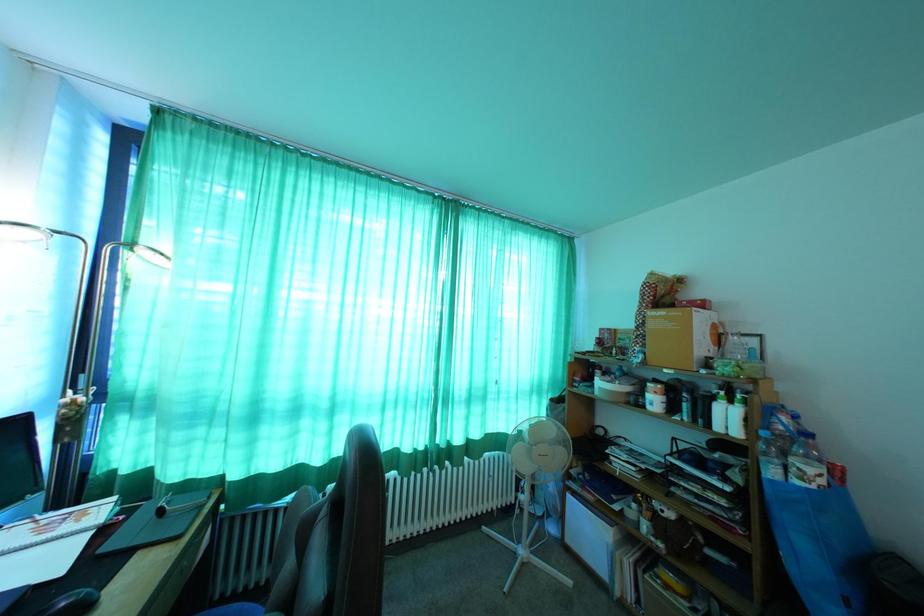
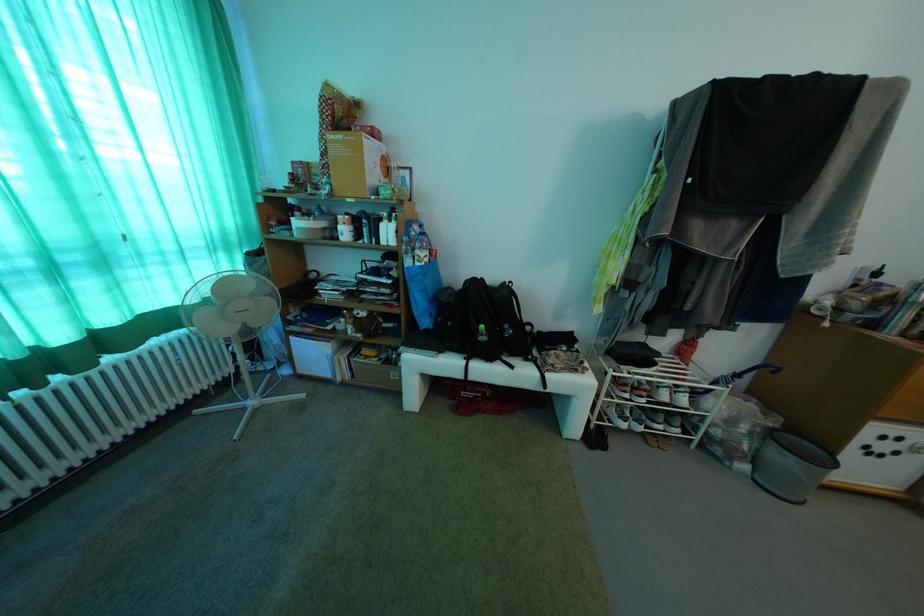
The first image is from the beginning of the video and the second image is from the end. How did the camera likely rotate when shooting the video?

The camera rotated toward right-down.